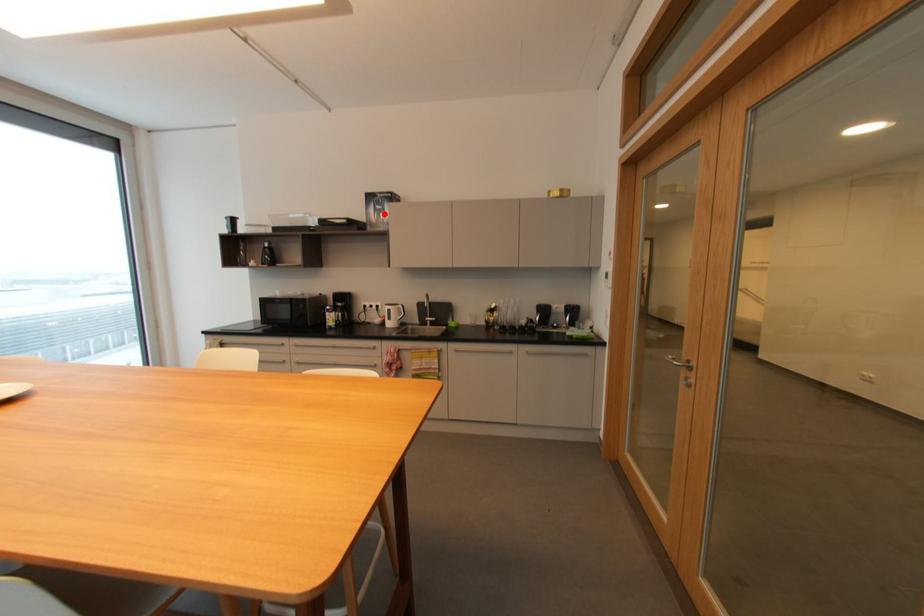
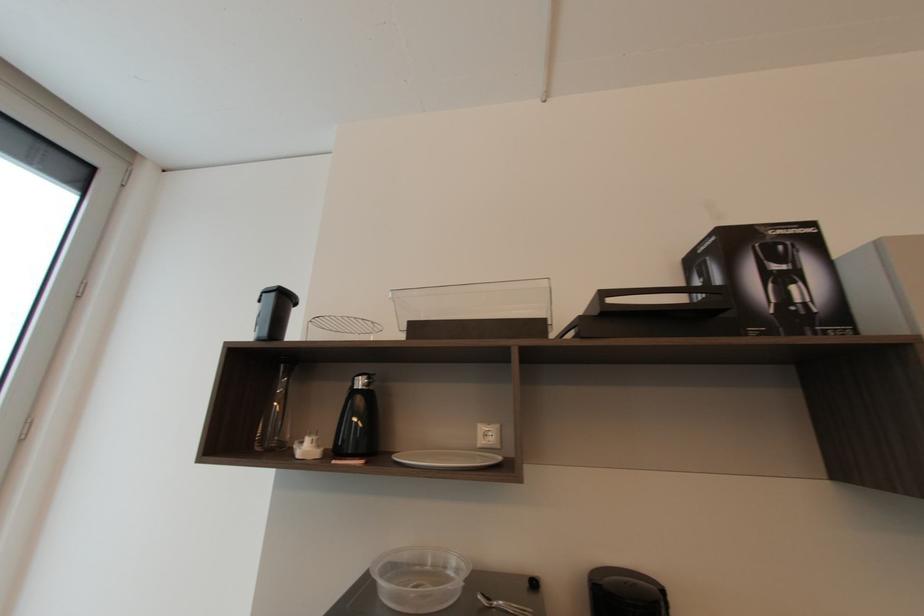
The point at the highlighted location is marked in the first image. Where is the corresponding point in the second image?

(796, 288)